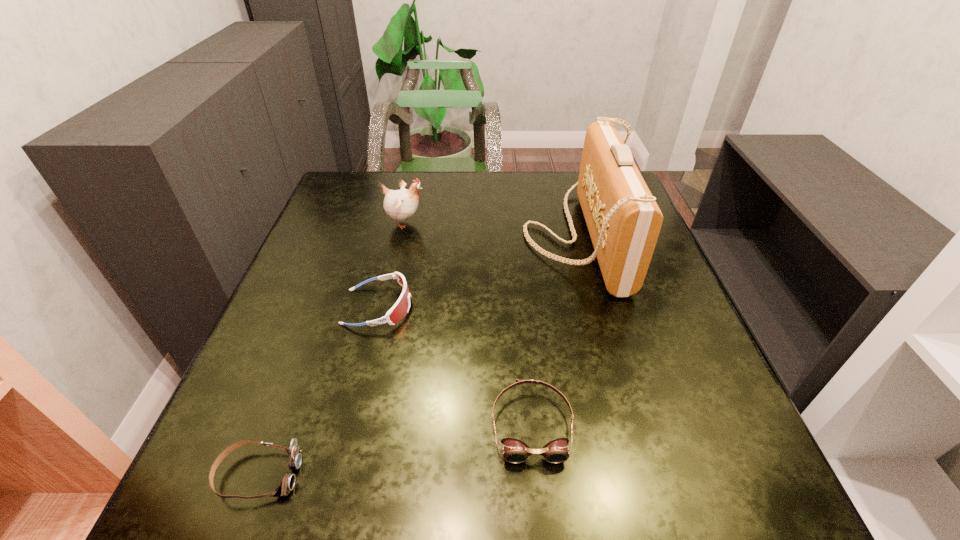
At what (x,y) coordinates should I click in order to perform the action: click on goggles identified as the closest to the rightmost goggles. Please return your answer as a coordinate pair (x, y). This screenshot has height=540, width=960. Looking at the image, I should click on (399, 310).